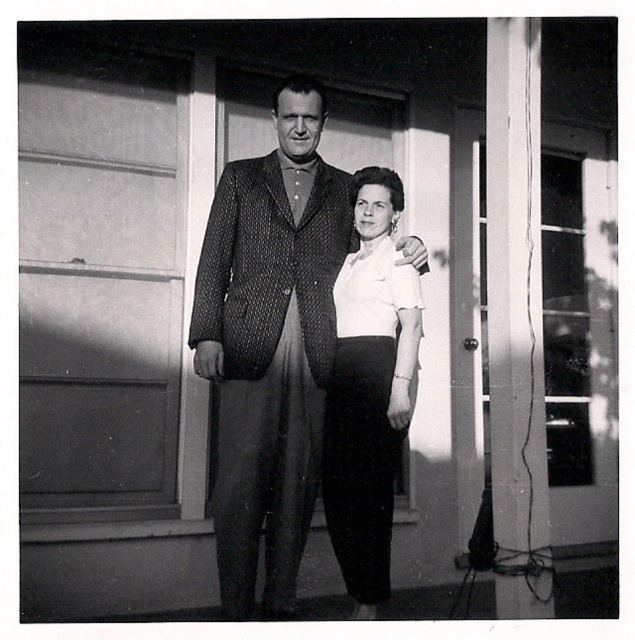
Can you confirm if smooth wood pillar at right is wider than white cotton blouse at center?

No.

The height and width of the screenshot is (640, 635). Identify the location of smooth wood pillar at right. (516, 320).

Locate an element on the screen. This screenshot has width=635, height=640. smooth wood pillar at right is located at coordinates (516, 320).

I want to click on smooth wood pillar at right, so click(516, 320).

Is polka dot suit at center below white cotton blouse at center?

Incorrect, polka dot suit at center is not positioned below white cotton blouse at center.

Does polka dot suit at center have a larger size compared to white cotton blouse at center?

Correct, polka dot suit at center is larger in size than white cotton blouse at center.

This screenshot has width=635, height=640. In order to click on polka dot suit at center in this screenshot , I will do `click(271, 344)`.

Where is `polka dot suit at center`? This screenshot has height=640, width=635. polka dot suit at center is located at coordinates (271, 344).

Is point (312, 97) farther from camera compared to point (490, 344)?

Yes, it is.

Is polka dot suit at center taller than smooth wood pillar at right?

Indeed, polka dot suit at center has a greater height compared to smooth wood pillar at right.

Which is in front, point (319, 444) or point (518, 396)?

Positioned in front is point (518, 396).

Locate an element on the screen. polka dot suit at center is located at coordinates (271, 344).